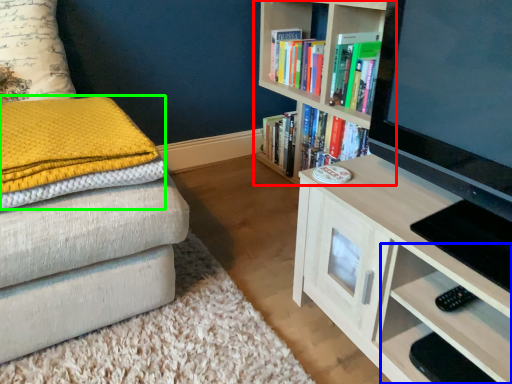
Question: Considering the real-world distances, which object is closest to bookcase (highlighted by a red box)? drawer (highlighted by a blue box) or blanket (highlighted by a green box).

Choices:
 (A) drawer
 (B) blanket

Answer: (A)